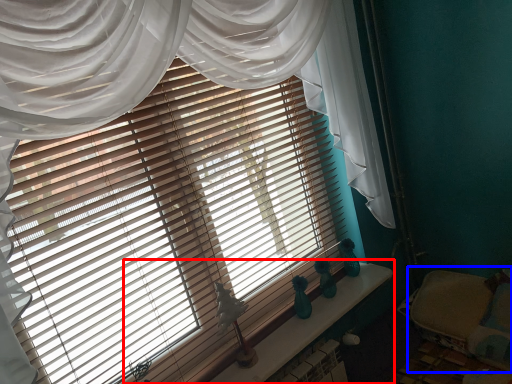
Question: Which object is further to the camera taking this photo, window sill (highlighted by a red box) or bed (highlighted by a blue box)?

Choices:
 (A) window sill
 (B) bed

Answer: (B)